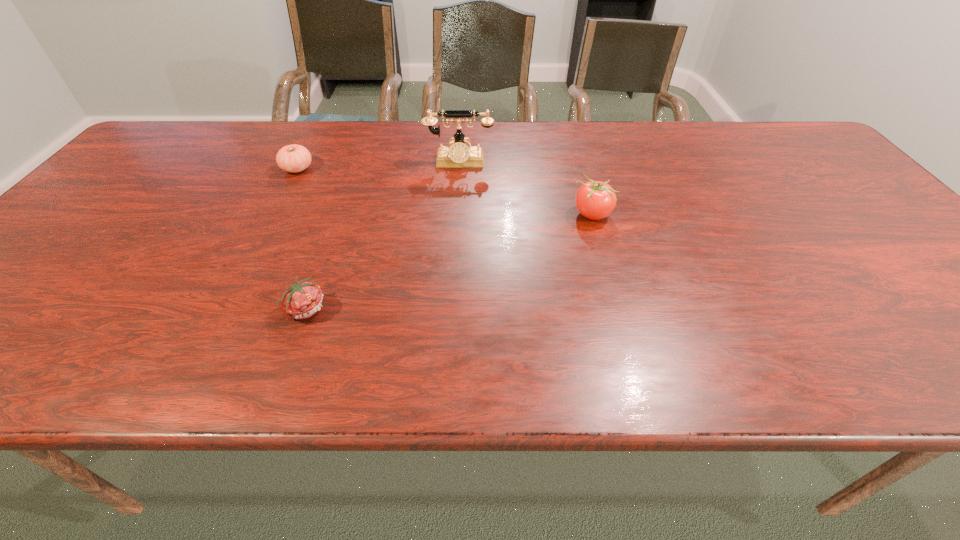
Locate an element on the screen. The image size is (960, 540). vacant space located on the back of the leftmost tomato is located at coordinates (313, 139).

At what (x,y) coordinates should I click in order to perform the action: click on vacant space located 0.190m on the left of the nearest object. Please return your answer as a coordinate pair (x, y). The height and width of the screenshot is (540, 960). Looking at the image, I should click on coord(190,308).

Identify the location of telephone that is at the far edge. tap(458, 155).

The width and height of the screenshot is (960, 540). In order to click on tomato that is at the far edge in this screenshot , I will do `click(294, 158)`.

At what (x,y) coordinates should I click in order to perform the action: click on vacant region at the far edge of the desktop. Please return your answer as a coordinate pair (x, y). The width and height of the screenshot is (960, 540). Looking at the image, I should click on (530, 131).

In the image, there is a desktop. Identify the location of vacant space at the near edge. (167, 353).

This screenshot has height=540, width=960. Find the location of `vacant region at the left edge of the desktop`. vacant region at the left edge of the desktop is located at coordinates (26, 280).

Where is `free space at the right edge`? This screenshot has width=960, height=540. free space at the right edge is located at coordinates (825, 171).

The height and width of the screenshot is (540, 960). Identify the location of free spot between the third object from right to left and the tallest object. (382, 235).

Find the location of a particular element. free space between the tallest tomato and the tallest object is located at coordinates (525, 188).